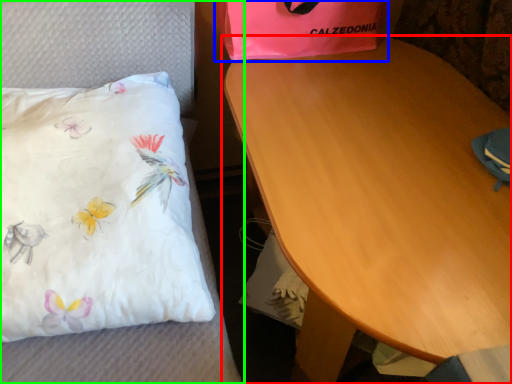
Question: Considering the real-world distances, which object is closest to table (highlighted by a red box)? gift bag (highlighted by a blue box) or furniture (highlighted by a green box).

Choices:
 (A) gift bag
 (B) furniture

Answer: (A)